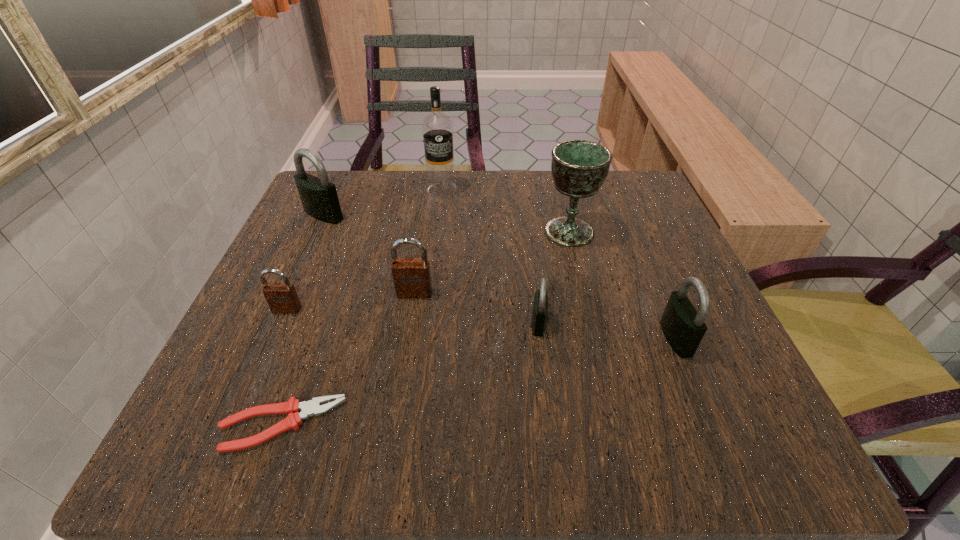
The height and width of the screenshot is (540, 960). Identify the location of vacant space located on the left of the sixth object from left to right. (346, 323).

Locate an element on the screen. The width and height of the screenshot is (960, 540). free space located on the front-facing side of the nearer brown padlock is located at coordinates (245, 406).

You are a GUI agent. You are given a task and a screenshot of the screen. Output one action in this format:
    pyautogui.click(x=<x>, y=<y>)
    Task: Click on the vacant space located 0.390m on the back of the pliers
    The height and width of the screenshot is (540, 960).
    Given the screenshot: What is the action you would take?
    pyautogui.click(x=350, y=229)

Find the location of a particular element. vodka that is at the far edge is located at coordinates (437, 127).

Where is `chalice present at the far edge`? The width and height of the screenshot is (960, 540). chalice present at the far edge is located at coordinates coord(579,167).

The width and height of the screenshot is (960, 540). In order to click on padlock at the far edge in this screenshot , I will do `click(319, 198)`.

Locate an element on the screen. This screenshot has height=540, width=960. object at the near edge is located at coordinates (292, 407).

This screenshot has width=960, height=540. I want to click on pliers that is positioned at the left edge, so click(292, 407).

Identify the location of chalice at the right edge. (579, 167).

Where is `padlock situated at the right edge`? padlock situated at the right edge is located at coordinates (683, 326).